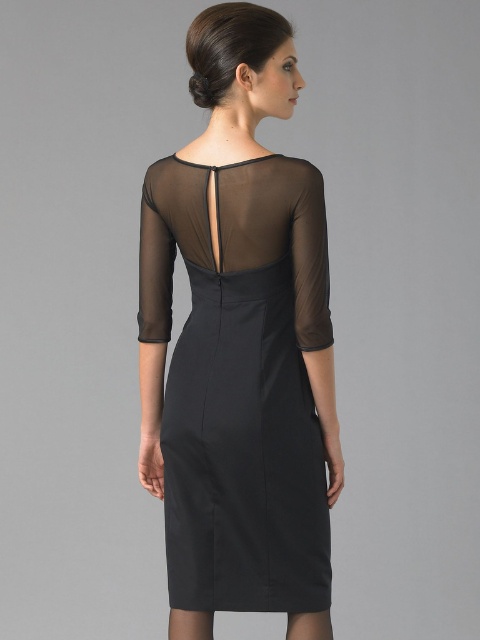
Between black sheer dress at center and sheer black sleeve at back, which one is positioned lower?

Positioned lower is black sheer dress at center.

Does black sheer dress at center have a greater height compared to sheer black sleeve at back?

Yes, black sheer dress at center is taller than sheer black sleeve at back.

The width and height of the screenshot is (480, 640). I want to click on black sheer dress at center, so click(240, 381).

Who is taller, black sheer dress at center or sheer brown sleeve at right?

black sheer dress at center

Is point (175, 209) closer to viewer compared to point (317, 276)?

No.

This screenshot has width=480, height=640. What are the coordinates of `black sheer dress at center` in the screenshot? It's located at (240, 381).

Does sheer brown sleeve at right have a smaller size compared to sheer black sleeve at back?

Indeed, sheer brown sleeve at right has a smaller size compared to sheer black sleeve at back.

The height and width of the screenshot is (640, 480). Identify the location of sheer brown sleeve at right. (309, 253).